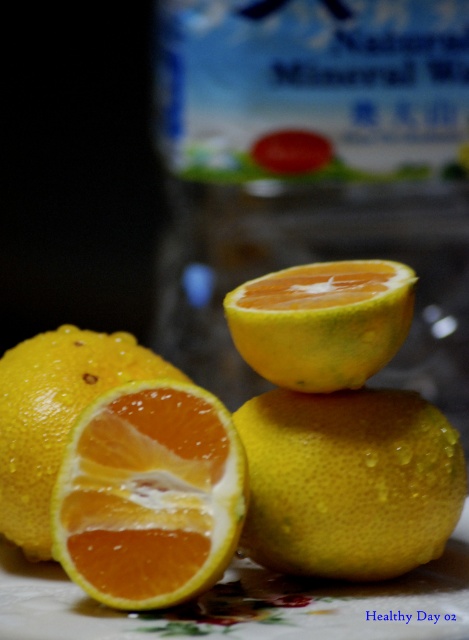
You are a photographer trying to capture the citrus fruit arrangement. You notice two points marked on your viewfinder at coordinates point (378,472) and point (81,333). Which point is nearer to your camera lens?

Point (378,472) is closer to the camera than point (81,333).